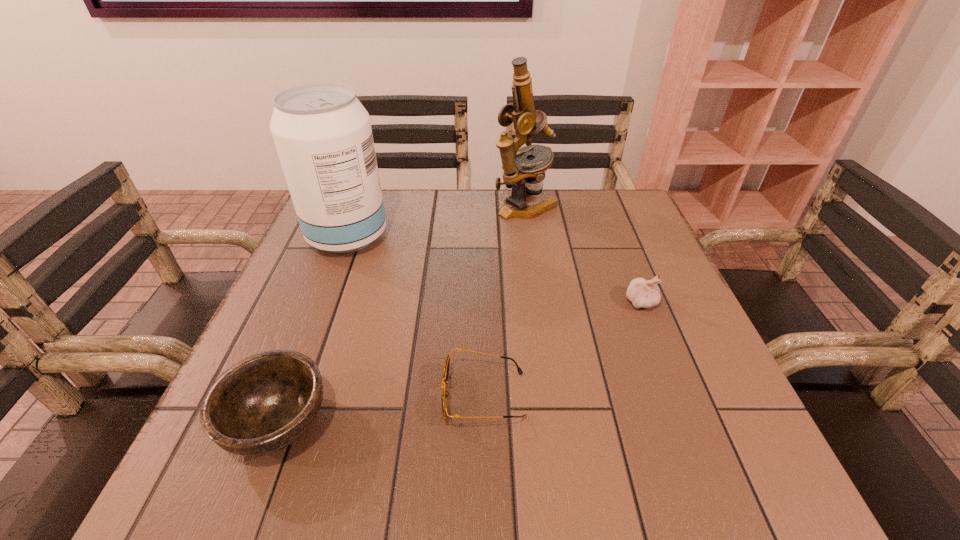
Image resolution: width=960 pixels, height=540 pixels. Identify the location of object positioned at the near left corner. coord(262,404).

Identify the location of free space at the far edge of the desktop. This screenshot has height=540, width=960. (391, 195).

You are a GUI agent. You are given a task and a screenshot of the screen. Output one action in this format:
    pyautogui.click(x=<x>, y=<y>)
    Task: Click on the free space at the near edge
    The width and height of the screenshot is (960, 540).
    Given the screenshot: What is the action you would take?
    pyautogui.click(x=588, y=451)

Where is `vacant space at the left edge`? This screenshot has width=960, height=540. vacant space at the left edge is located at coordinates (334, 299).

I want to click on free space at the right edge of the desktop, so click(691, 349).

Locate an element on the screen. Image resolution: width=960 pixels, height=540 pixels. vacant space at the far right corner is located at coordinates (624, 190).

In the image, there is a desktop. Where is `free region at the near right corner`? free region at the near right corner is located at coordinates (720, 490).

Locate an element on the screen. Image resolution: width=960 pixels, height=540 pixels. vacant space that is in between the microscope and the shortest object is located at coordinates (504, 301).

Identify the location of free spot between the shortest object and the alcohol. (416, 316).

In order to click on vacant point located between the garlic and the shortest object in this screenshot , I will do `click(562, 348)`.